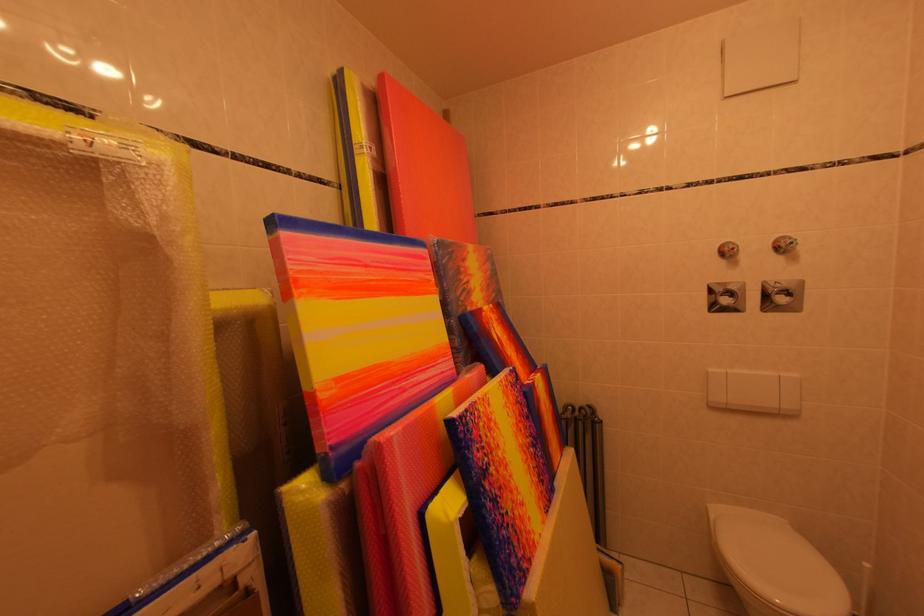
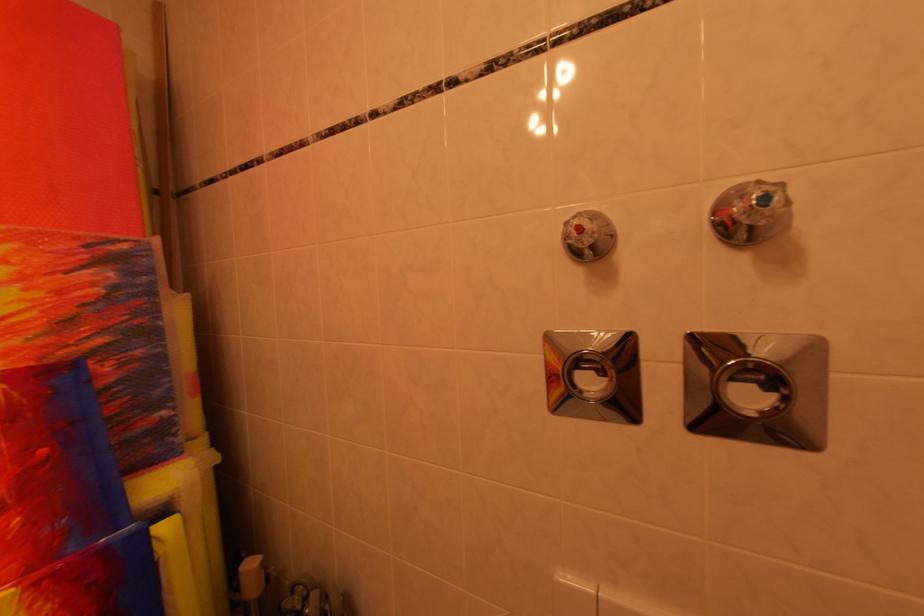
Locate, in the second image, the point that corresponds to the point at 742,253 in the first image.

(589, 232)